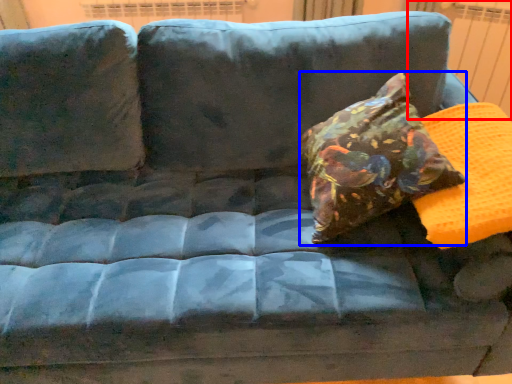
Question: Which object appears farthest to the camera in this image, radiator (highlighted by a red box) or throw pillow (highlighted by a blue box)?

Choices:
 (A) radiator
 (B) throw pillow

Answer: (A)